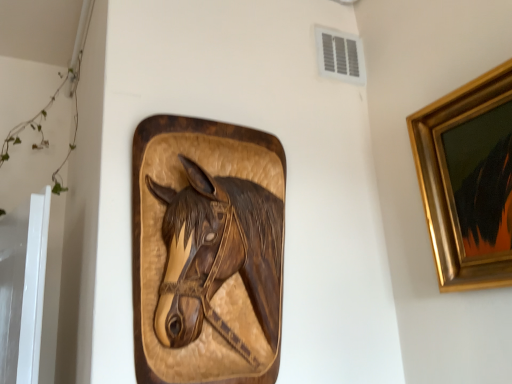
Question: Relative to wooden carved horse head at center, is gold-framed painting at upper right in front or behind?

Choices:
 (A) behind
 (B) front

Answer: (B)

Question: Considering the positions of gold-framed painting at upper right and wooden carved horse head at center in the image, is gold-framed painting at upper right wider or thinner than wooden carved horse head at center?

Choices:
 (A) thin
 (B) wide

Answer: (A)

Question: Which is farther from the white plastic vent at upper center?

Choices:
 (A) gold-framed painting at upper right
 (B) wooden carved horse head at center

Answer: (B)

Question: Which is nearer to the wooden carved horse head at center?

Choices:
 (A) white plastic vent at upper center
 (B) gold-framed painting at upper right

Answer: (B)